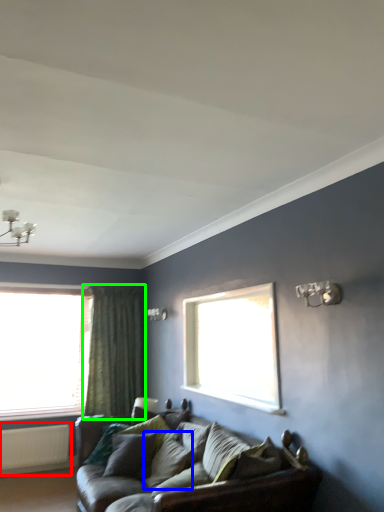
Question: Based on their relative distances, which object is nearer to radiator (highlighted by a red box)? Choose from pillow (highlighted by a blue box) and curtain (highlighted by a green box).

Choices:
 (A) pillow
 (B) curtain

Answer: (B)